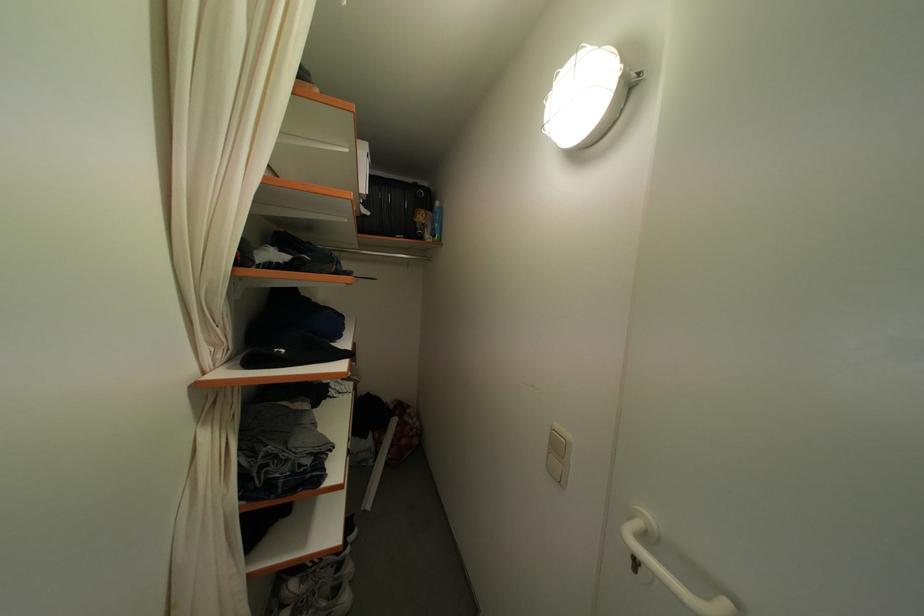
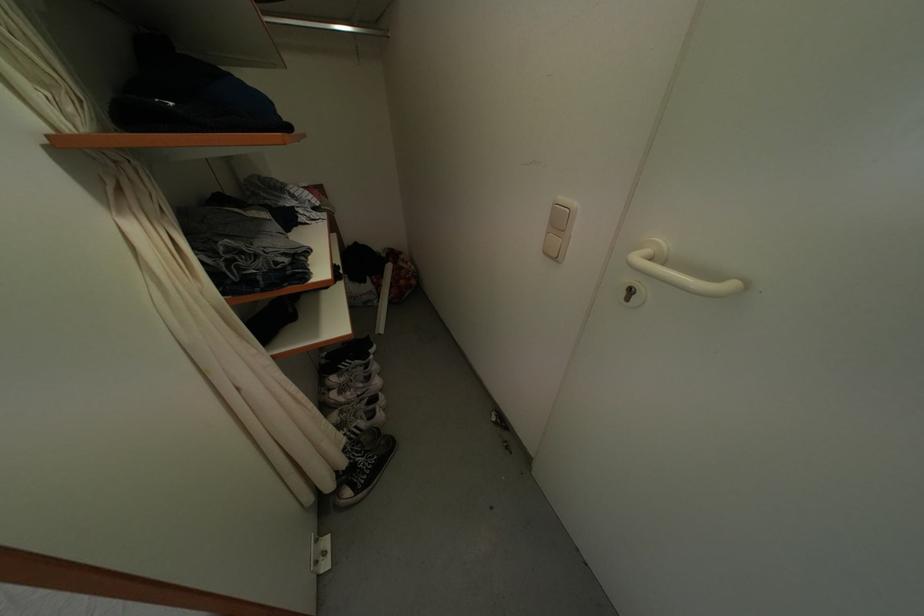
Locate, in the second image, the point that corresponds to [637,567] in the first image.

(630, 299)